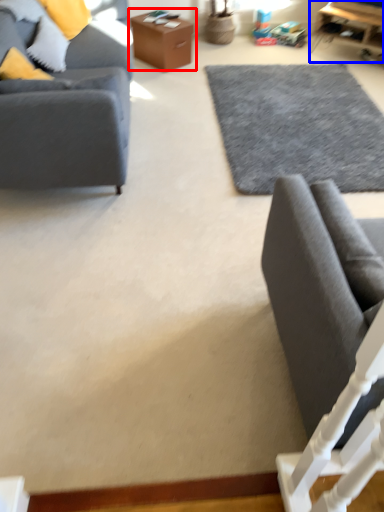
Question: Which object appears closest to the camera in this image, table (highlighted by a red box) or table (highlighted by a blue box)?

Choices:
 (A) table
 (B) table

Answer: (A)